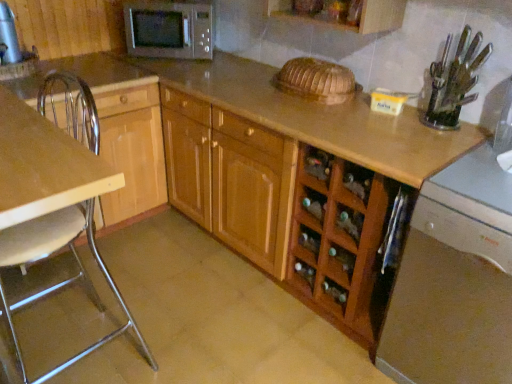
Locate an element on the screen. vacant region in front of clear plastic knife block at upper right, the second appliance when ordered from back to front is located at coordinates (446, 145).